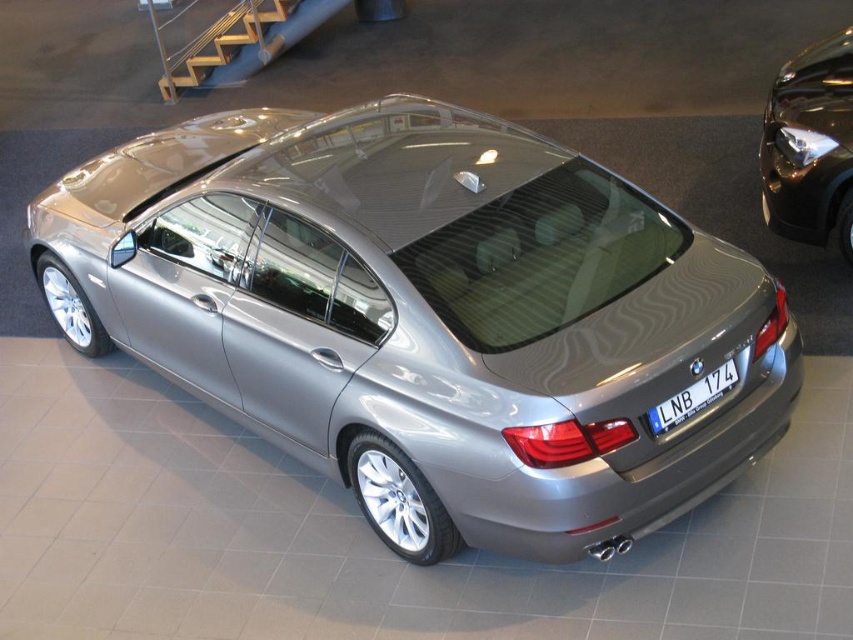
Is satin metallic car at center taller than blue metallic license plate at rear?

Indeed, satin metallic car at center has a greater height compared to blue metallic license plate at rear.

Between satin metallic car at center and blue metallic license plate at rear, which one is positioned higher?

Positioned higher is satin metallic car at center.

This screenshot has height=640, width=853. Describe the element at coordinates (427, 316) in the screenshot. I see `satin metallic car at center` at that location.

Find the location of `satin metallic car at center`. satin metallic car at center is located at coordinates (427, 316).

How distant is satin metallic car at center from glossy black car at upper right?

They are 10.00 feet apart.

Is satin metallic car at center below glossy black car at upper right?

Indeed, satin metallic car at center is positioned under glossy black car at upper right.

This screenshot has width=853, height=640. What do you see at coordinates (427, 316) in the screenshot?
I see `satin metallic car at center` at bounding box center [427, 316].

At what (x,y) coordinates should I click in order to perform the action: click on satin metallic car at center. Please return your answer as a coordinate pair (x, y). Looking at the image, I should click on (427, 316).

How far apart are glossy black car at upper right and blue metallic license plate at rear?

glossy black car at upper right and blue metallic license plate at rear are 2.64 meters apart.

Between point (840, 33) and point (733, 376), which one is positioned in front?

Positioned in front is point (733, 376).

I want to click on glossy black car at upper right, so pyautogui.click(x=810, y=147).

You are a GUI agent. You are given a task and a screenshot of the screen. Output one action in this format:
    pyautogui.click(x=<x>, y=<y>)
    Task: Click on the glossy black car at upper right
    This screenshot has height=640, width=853.
    Given the screenshot: What is the action you would take?
    pyautogui.click(x=810, y=147)